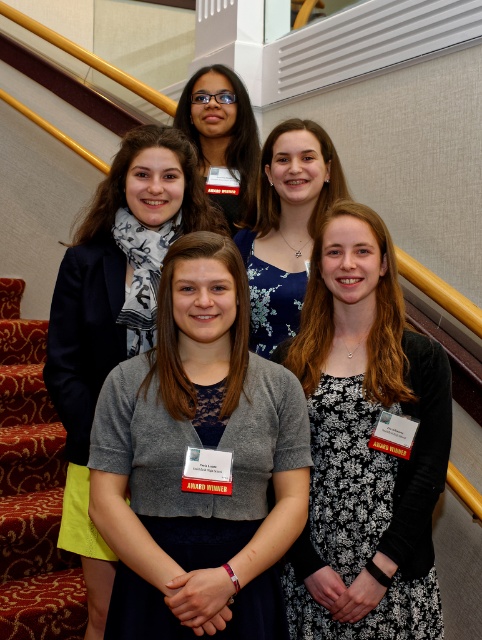
Looking at the scene with the staircase and the women, can you tell me which item is positioned to the left of the other between the gray knit cardigan at center and the matte black glasses at upper center?

The gray knit cardigan at center is positioned to the left of the matte black glasses at upper center.

You are standing at the base of the staircase and want to greet two people located at point (229, 397) and point (142, 170). Which person should you approach first if you want to greet the one closer to you?

Point (229, 397) is in front of point (142, 170), so you should approach the person at point (229, 397) first as they are closer to you.